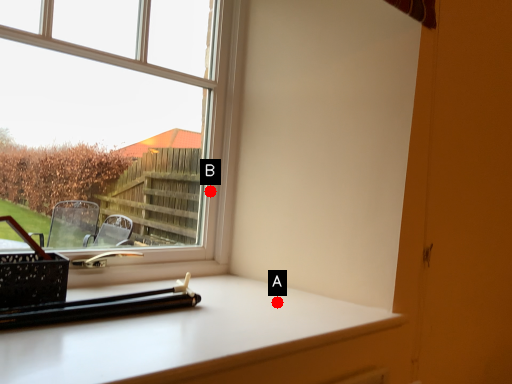
Question: Two points are circled on the image, labeled by A and B beside each circle. Which point is closer to the camera?

Choices:
 (A) A is closer
 (B) B is closer

Answer: (A)